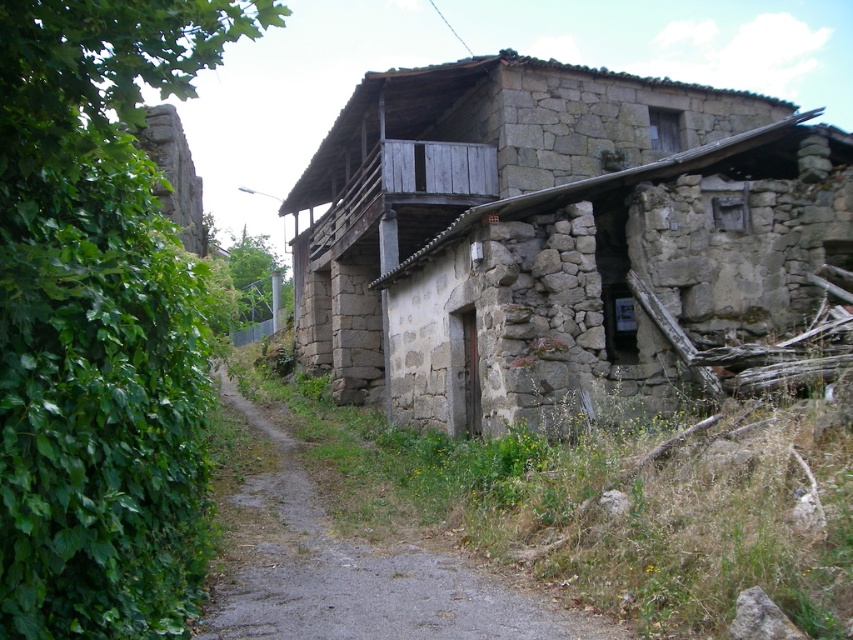
Question: Is gray stone house at center further to the viewer compared to green leafy ivy at left?

Choices:
 (A) yes
 (B) no

Answer: (A)

Question: Does gray stone house at center have a smaller size compared to dirt/gravel path at center?

Choices:
 (A) yes
 (B) no

Answer: (B)

Question: Among these objects, which one is nearest to the camera?

Choices:
 (A) dirt/gravel path at center
 (B) green leafy ivy at left
 (C) gray stone house at center

Answer: (B)

Question: Which point is farther from the camera taking this photo?

Choices:
 (A) (143, 280)
 (B) (432, 408)

Answer: (B)

Question: Which point is closer to the camera?

Choices:
 (A) tap(842, 211)
 (B) tap(45, 253)
 (C) tap(282, 582)

Answer: (B)

Question: Is green leafy ivy at left further to the viewer compared to dirt/gravel path at center?

Choices:
 (A) yes
 (B) no

Answer: (B)